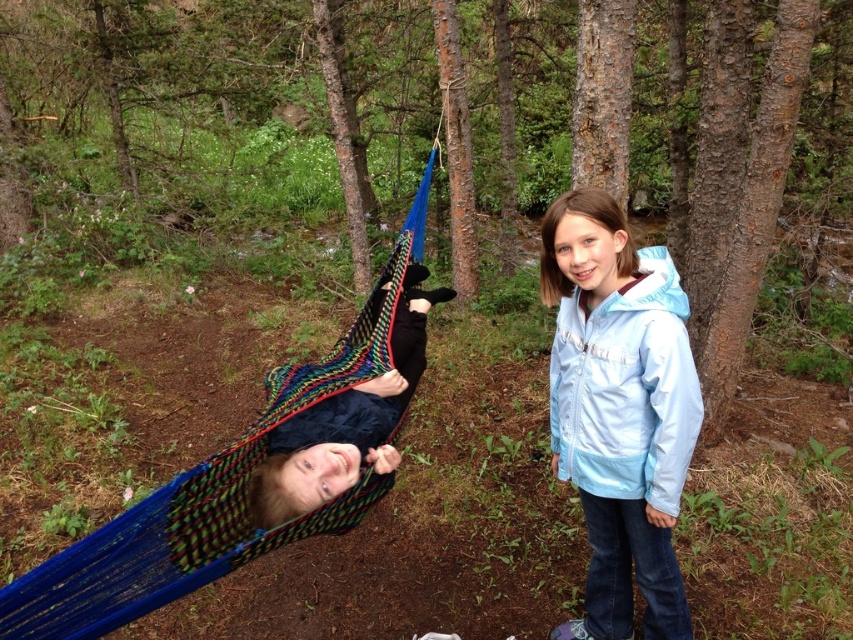
Question: Which object is the farthest from the smooth bark tree at center?

Choices:
 (A) multicolored woven hammock at left
 (B) multicolored knitted hammock at center
 (C) brown rough bark tree at center right

Answer: (B)

Question: Can you confirm if multicolored woven hammock at left is thinner than brown rough bark at upper center?

Choices:
 (A) yes
 (B) no

Answer: (B)

Question: Which of the following is the farthest from the observer?

Choices:
 (A) (643, 492)
 (B) (583, 88)
 (C) (751, 275)

Answer: (B)

Question: Estimate the real-world distances between objects in this image. Which object is farther from the multicolored woven hammock at left?

Choices:
 (A) brown rough bark at upper center
 (B) multicolored knitted hammock at center
 (C) brown rough bark tree at center right
 (D) light blue fabric jacket at center

Answer: (C)

Question: Does light blue fabric jacket at center have a larger size compared to smooth bark tree at center?

Choices:
 (A) no
 (B) yes

Answer: (A)

Question: Is light blue fabric jacket at center behind brown rough bark at upper center?

Choices:
 (A) no
 (B) yes

Answer: (A)